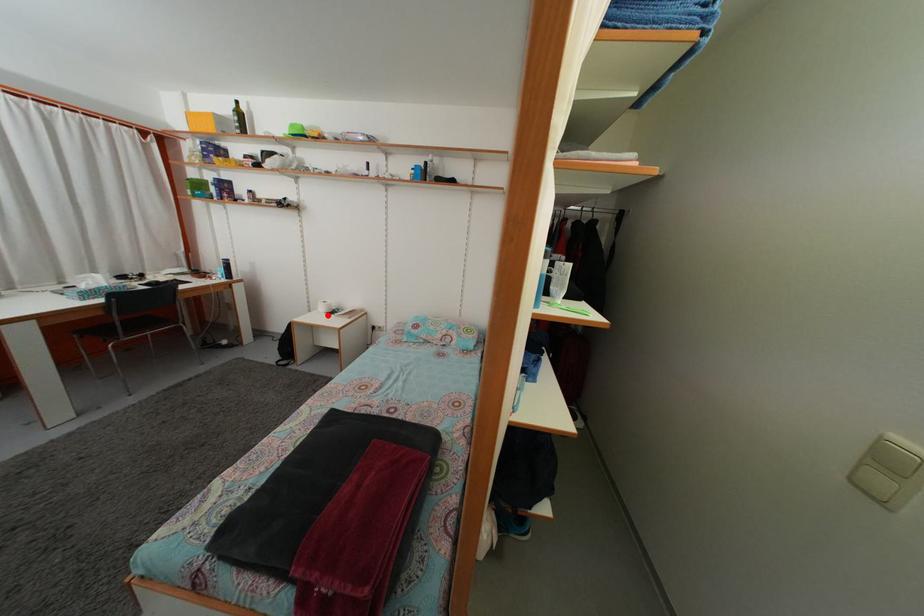
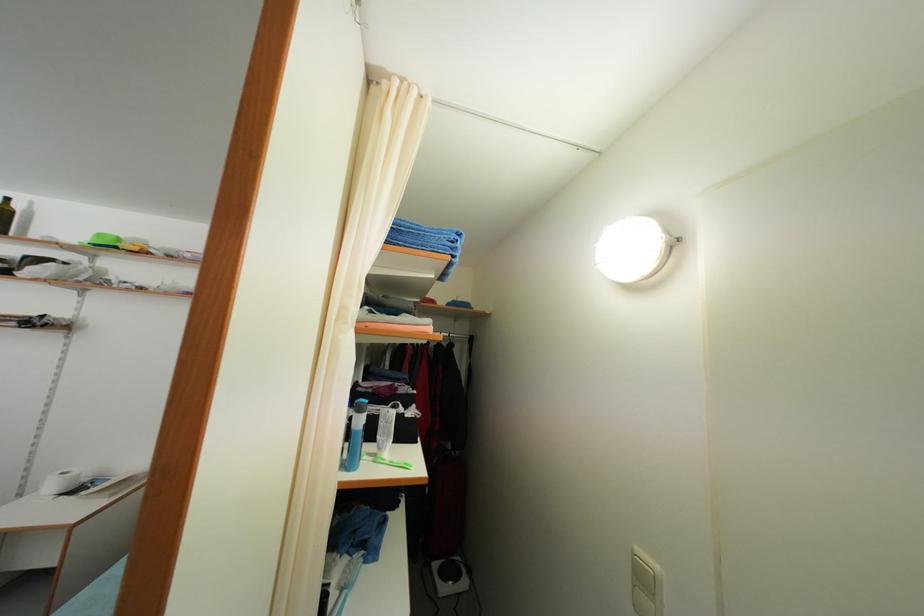
Where in the second image is the point corresponding to the highlighted location from the first image?

(56, 493)